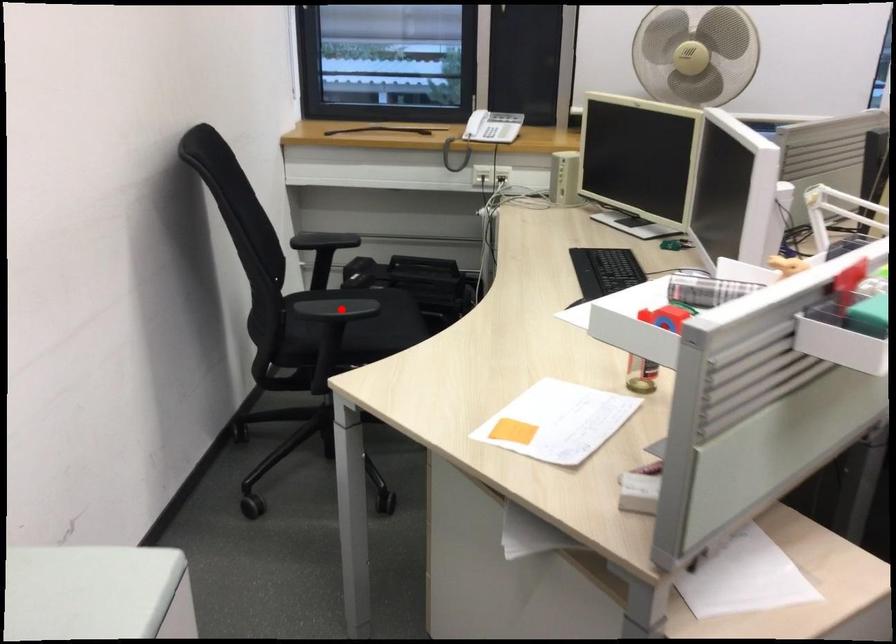
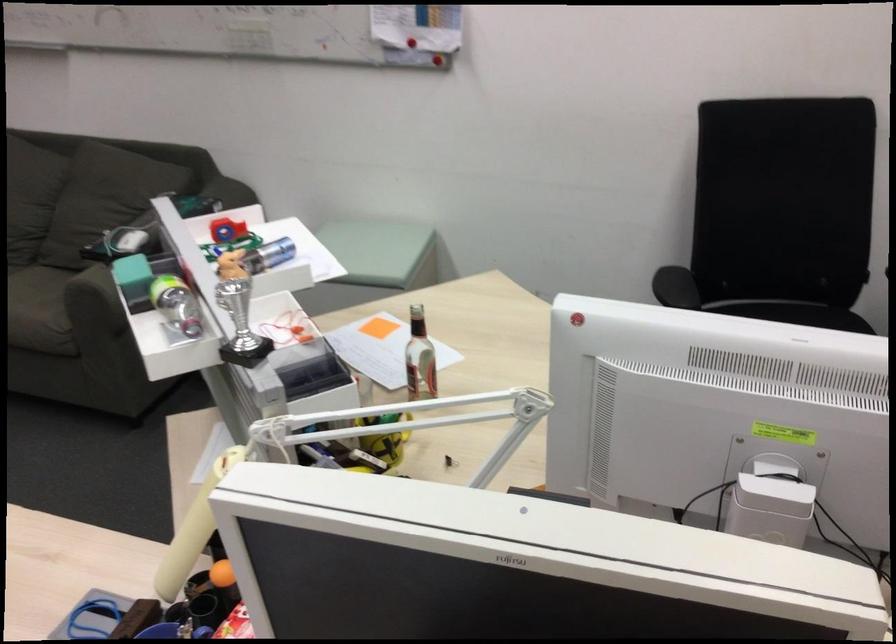
In the second image, find the point that corresponds to the highlighted location in the first image.

(675, 287)